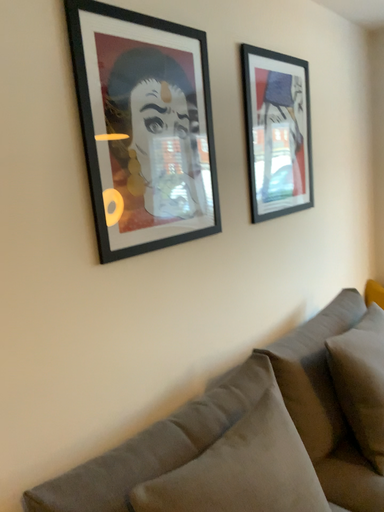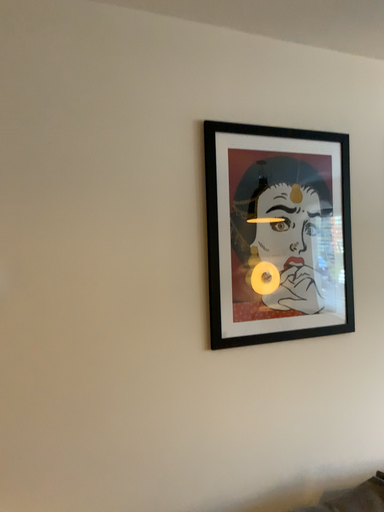
Question: How did the camera likely rotate when shooting the video?

Choices:
 (A) rotated right
 (B) rotated left

Answer: (B)